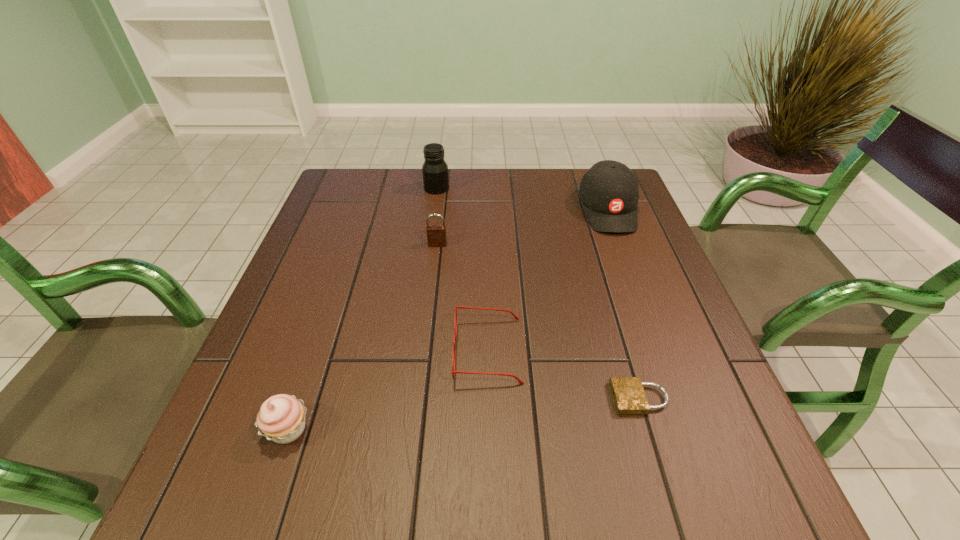
Locate an element on the screen. jar is located at coordinates (435, 170).

Where is `baseball cap`? baseball cap is located at coordinates (609, 191).

Locate an element on the screen. The width and height of the screenshot is (960, 540). the left padlock is located at coordinates (436, 234).

Identify the location of the fourth nearest object. (436, 234).

Where is `cupcake`? The height and width of the screenshot is (540, 960). cupcake is located at coordinates (281, 418).

At what (x,y) coordinates should I click in order to perform the action: click on spectacles. Please return your answer as a coordinate pair (x, y). Looking at the image, I should click on (462, 307).

Locate an element on the screen. the third object from right to left is located at coordinates (462, 307).

The image size is (960, 540). I want to click on the right padlock, so click(629, 397).

You are a GUI agent. You are given a task and a screenshot of the screen. Output one action in this format:
    pyautogui.click(x=<x>, y=<y>)
    Task: Click on the shorter padlock
    This screenshot has height=540, width=960.
    Given the screenshot: What is the action you would take?
    pyautogui.click(x=629, y=397)

What are the coordinates of `vacant region located on the right of the jar` in the screenshot? It's located at (564, 188).